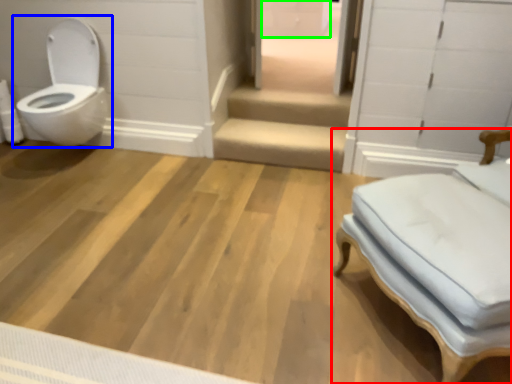
Question: Based on their relative distances, which object is nearer to furniture (highlighted by a red box)? Choose from toilet (highlighted by a blue box) and drawer (highlighted by a green box).

Choices:
 (A) toilet
 (B) drawer

Answer: (A)